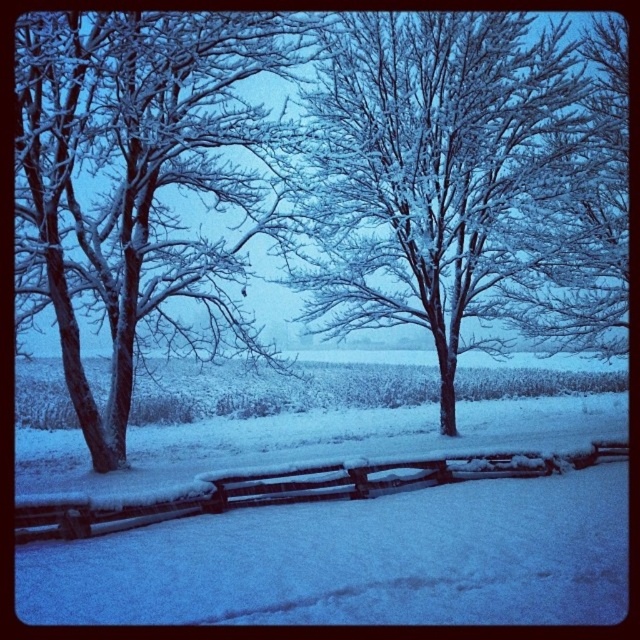
In the winter scene, there is a point marked at coordinates (449, 177). What object in the image corresponds to this coordinate?

The point at coordinates (449, 177) corresponds to the snow covered branches at center.